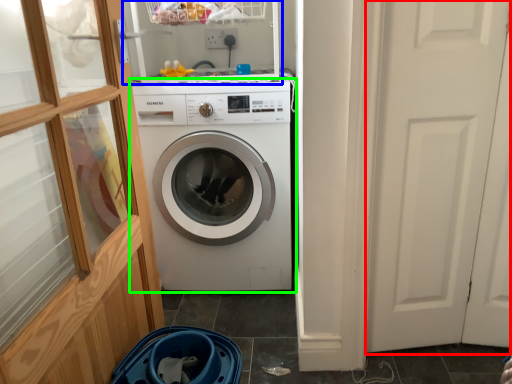
Question: Based on their relative distances, which object is nearer to screen door (highlighted by a red box)? Choose from shelf (highlighted by a blue box) and washing machine (highlighted by a green box).

Choices:
 (A) shelf
 (B) washing machine

Answer: (B)